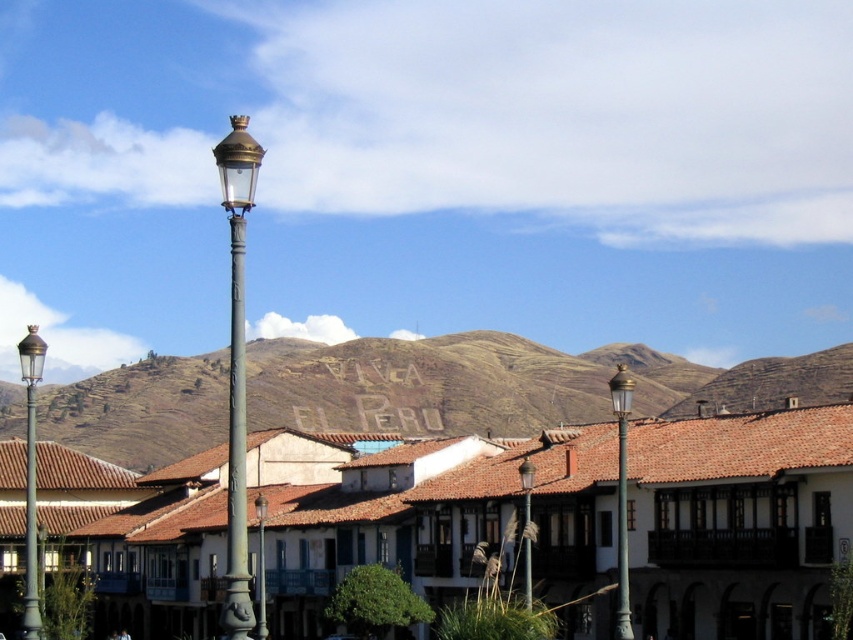
Question: Which is farther from the green polished metal street light at right?

Choices:
 (A) bronze/golden street light at left
 (B) brushed metal street light at center
 (C) bronze textured street light at center

Answer: (A)

Question: Can you confirm if brown tiled roof at center is positioned below gold-bronze streetlight at center-left?

Choices:
 (A) no
 (B) yes

Answer: (B)

Question: Can you confirm if gold-bronze streetlight at center-left is positioned to the left of brushed metal street light at center?

Choices:
 (A) yes
 (B) no

Answer: (A)

Question: Is brown tiled roof at center to the right of bronze textured street light at center from the viewer's perspective?

Choices:
 (A) no
 (B) yes

Answer: (A)

Question: Which of the following is the closest to the observer?

Choices:
 (A) (260, 628)
 (B) (33, 509)
 (C) (312, 390)

Answer: (B)

Question: Estimate the real-world distances between objects in this image. Which object is farther from the bronze textured street light at center?

Choices:
 (A) bronze/golden street light at left
 (B) green polished metal street light at right

Answer: (A)